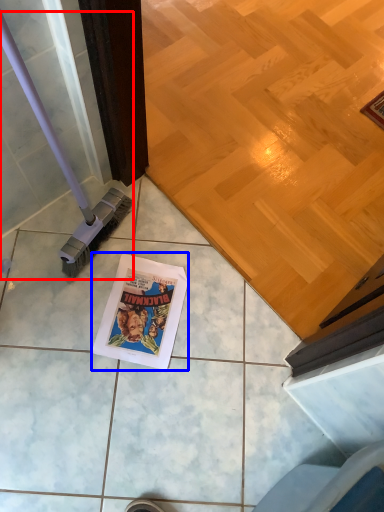
Question: Which point is further to the camera, brush (highlighted by a red box) or comic book (highlighted by a blue box)?

Choices:
 (A) brush
 (B) comic book

Answer: (B)